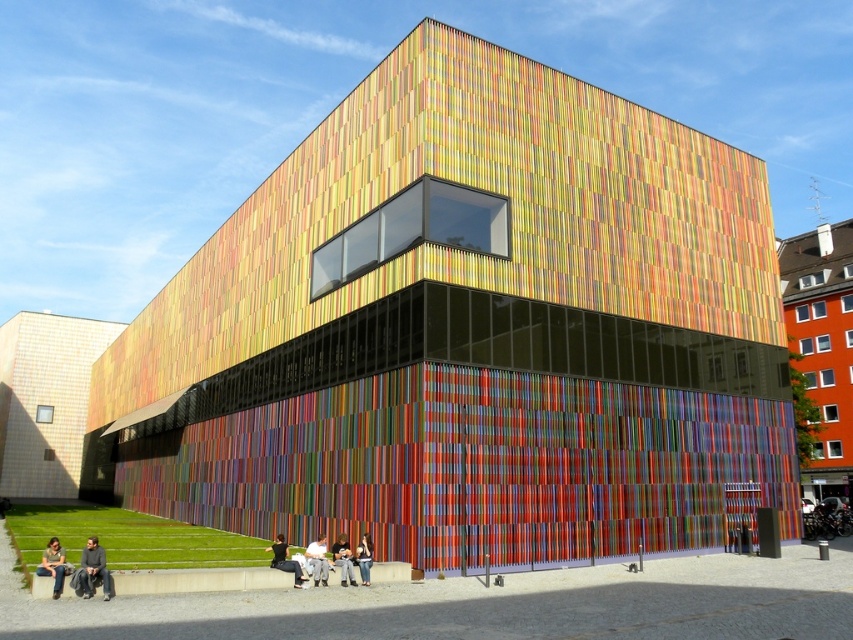
Can you confirm if multicolored wood paneling at lower left is bigger than denim jacket at lower center?

Indeed, multicolored wood paneling at lower left has a larger size compared to denim jacket at lower center.

Based on the photo, does multicolored wood paneling at lower left have a smaller size compared to denim jacket at lower center?

Incorrect, multicolored wood paneling at lower left is not smaller in size than denim jacket at lower center.

Find the location of a particular element. multicolored wood paneling at lower left is located at coordinates (45, 400).

Can you confirm if multicolored wood paneling at lower left is smaller than light gray fabric pants at lower center?

No, multicolored wood paneling at lower left is not smaller than light gray fabric pants at lower center.

Measure the distance between point (70, 472) and camera.

Point (70, 472) and camera are 72.17 meters apart from each other.

Locate an element on the screen. This screenshot has height=640, width=853. multicolored wood paneling at lower left is located at coordinates (45, 400).

Does black fabric jacket at lower center have a smaller size compared to denim jacket at lower center?

Indeed, black fabric jacket at lower center has a smaller size compared to denim jacket at lower center.

Is black fabric jacket at lower center further to camera compared to denim jacket at lower center?

Yes, it is behind denim jacket at lower center.

Does point (300, 588) come farther from viewer compared to point (352, 580)?

No, it is in front of (352, 580).

Where is `black fabric jacket at lower center`? This screenshot has height=640, width=853. black fabric jacket at lower center is located at coordinates (285, 561).